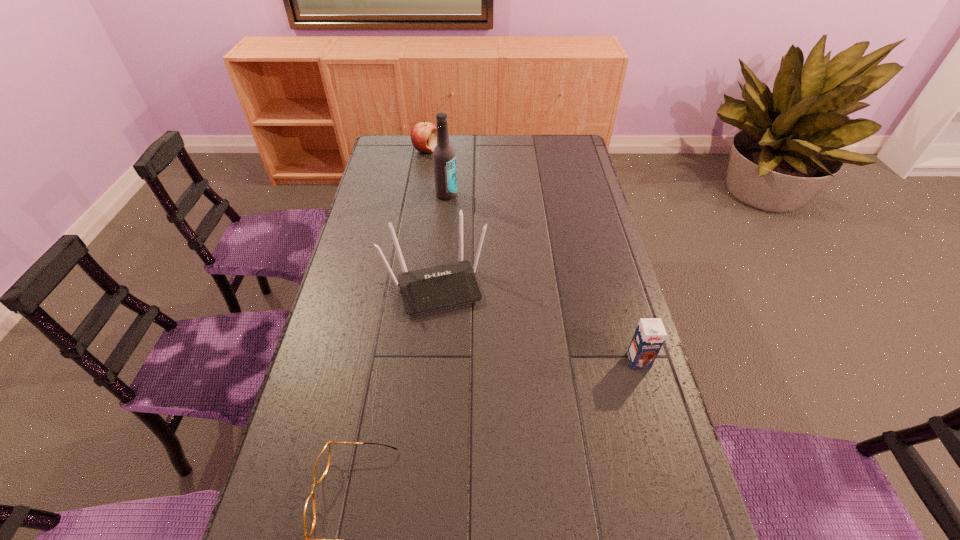
Find the location of a particular element. vacant space on the desktop that is between the spectacles and the fourth farthest object and is positioned on the label of the tallest object is located at coordinates (546, 404).

Identify the location of free spot on the desktop that is between the spectacles and the third tallest object and is positioned on the bitten side of the apple. (538, 408).

Image resolution: width=960 pixels, height=540 pixels. What are the coordinates of `vacant spot on the desktop that is between the spectacles and the fourth farthest object and is positioned on the front-facing side of the third farthest object` in the screenshot? It's located at (481, 435).